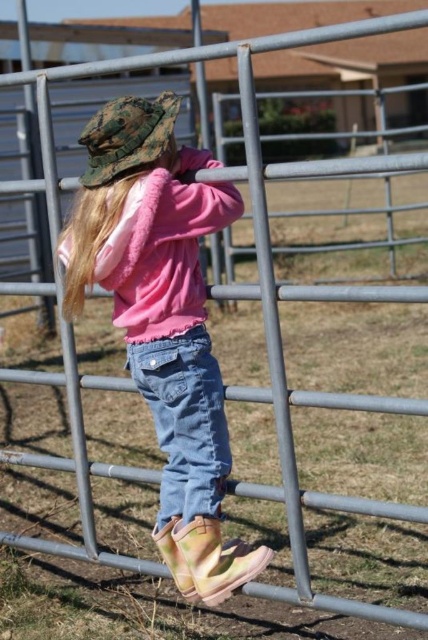
You are a fashion designer observing the girl in the image. You need to create a new outfit that maintains the same color scheme but uses different materials. Which item, the pink fleece jacket at center or the denim jeans at center, would you consider adjusting first to ensure the proportions of the outfit remain balanced?

The pink fleece jacket at center has a larger width than the denim jeans at center, so adjusting the denim jeans at center to be wider would help balance the proportions while keeping the pink color scheme.

You are a drone operator trying to capture a photo of the girl leaning against the metal fence. You have two markers placed at point (195, 326) and point (163, 134). Which marker is closer to the camera if the camera is positioned at the same level as the girl?

Point (163, 134) is closer to the camera because point (195, 326) is behind it.